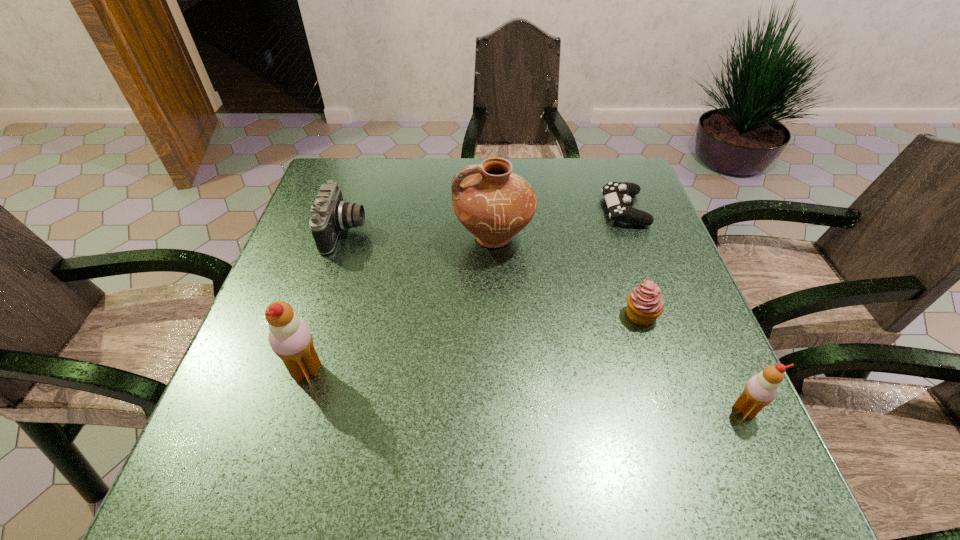
Locate an element on the screen. camera positioned at the left edge is located at coordinates (330, 214).

This screenshot has height=540, width=960. I want to click on icecream present at the right edge, so click(760, 390).

Identify the location of control that is at the right edge. (617, 195).

At what (x,y) coordinates should I click in order to perform the action: click on cupcake present at the right edge. Please return your answer as a coordinate pair (x, y). The image size is (960, 540). Looking at the image, I should click on (645, 304).

This screenshot has height=540, width=960. Identify the location of object that is at the near left corner. (290, 338).

Where is `object that is at the far right corner`? Image resolution: width=960 pixels, height=540 pixels. object that is at the far right corner is located at coordinates (617, 195).

Identify the location of object at the near right corner. (760, 390).

The image size is (960, 540). What are the coordinates of `free spot at the far edge of the desktop` in the screenshot? It's located at (469, 161).

In the image, there is a desktop. Where is `vacant space at the near edge`? vacant space at the near edge is located at coordinates coord(453,416).

In the image, there is a desktop. At what (x,y) coordinates should I click in order to perform the action: click on vacant space at the left edge. Please return your answer as a coordinate pair (x, y). The height and width of the screenshot is (540, 960). Looking at the image, I should click on (311, 327).